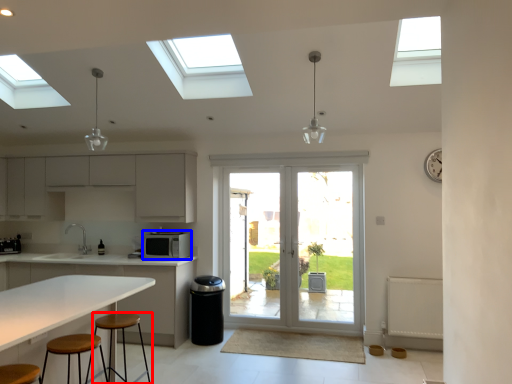
Question: Which object is further to the camera taking this photo, stool (highlighted by a red box) or appliance (highlighted by a blue box)?

Choices:
 (A) stool
 (B) appliance

Answer: (B)